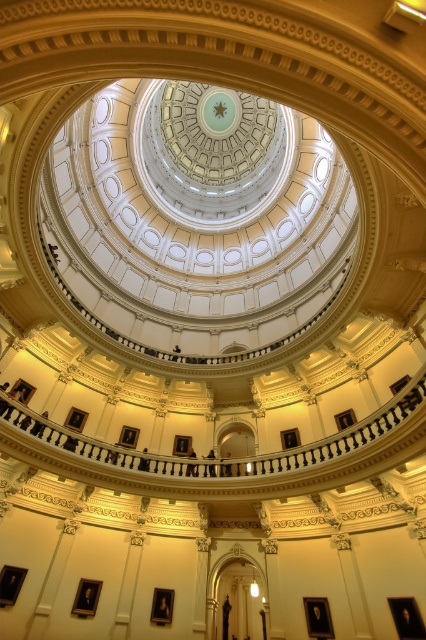
Can you confirm if white marble dome at center is shorter than white marble balustrade at center?

No.

Who is higher up, white marble dome at center or white marble balustrade at center?

white marble dome at center is above.

Is point (181, 152) positioned before point (109, 467)?

No, (181, 152) is further to viewer.

This screenshot has width=426, height=640. Identify the location of white marble dome at center. (198, 218).